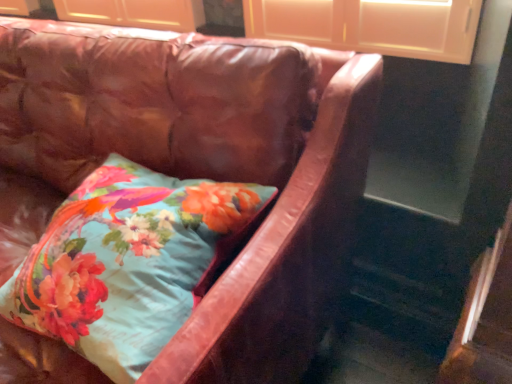
What do you see at coordinates (127, 262) in the screenshot? I see `floral fabric pillow at center` at bounding box center [127, 262].

The width and height of the screenshot is (512, 384). I want to click on floral fabric pillow at center, so click(x=127, y=262).

The height and width of the screenshot is (384, 512). Describe the element at coordinates (199, 167) in the screenshot. I see `leather couch at center` at that location.

Image resolution: width=512 pixels, height=384 pixels. I want to click on leather couch at center, so click(199, 167).

Find the location of `floral fabric pillow at center`. floral fabric pillow at center is located at coordinates (127, 262).

Does leather couch at center appear on the left side of floral fabric pillow at center?

Yes.

In the scene shown: Considering the relative positions of leather couch at center and floral fabric pillow at center in the image provided, is leather couch at center in front of floral fabric pillow at center?

Yes, leather couch at center is closer to the viewer.

Is point (49, 158) more distant than point (56, 303)?

Yes, it is behind point (56, 303).

From the image's perspective, which is below, leather couch at center or floral fabric pillow at center?

From the image's view, floral fabric pillow at center is below.

From a real-world perspective, which object stands above the other?

From a 3D spatial view, floral fabric pillow at center is above.

In the scene shown: Considering the sizes of objects leather couch at center and floral fabric pillow at center in the image provided, who is wider, leather couch at center or floral fabric pillow at center?

Wider between the two is leather couch at center.

Which of these two, leather couch at center or floral fabric pillow at center, stands shorter?

floral fabric pillow at center.

Between leather couch at center and floral fabric pillow at center, which one has smaller size?

Smaller between the two is floral fabric pillow at center.

Is leather couch at center not inside floral fabric pillow at center?

leather couch at center lies outside floral fabric pillow at center's area.

Is there a large distance between leather couch at center and floral fabric pillow at center?

No, leather couch at center is not far away from floral fabric pillow at center.

Could you tell me if leather couch at center is turned towards floral fabric pillow at center?

Yes.

How far apart are leather couch at center and floral fabric pillow at center?

leather couch at center is 7.28 inches from floral fabric pillow at center.

At what (x,y) coordinates should I click in order to perform the action: click on studio couch in front of the floral fabric pillow at center. Please return your answer as a coordinate pair (x, y). The image size is (512, 384). Looking at the image, I should click on (199, 167).

Which is more to the left, floral fabric pillow at center or leather couch at center?

leather couch at center is more to the left.

Which object is more forward, floral fabric pillow at center or leather couch at center?

Positioned in front is leather couch at center.

Which is in front, point (121, 366) or point (86, 156)?

The point (121, 366) is closer to the camera.

From the image's perspective, would you say floral fabric pillow at center is positioned over leather couch at center?

No, from the image's perspective, floral fabric pillow at center is not above leather couch at center.

From the picture: From a real-world perspective, is floral fabric pillow at center over leather couch at center?

Indeed, from a real-world perspective, floral fabric pillow at center stands above leather couch at center.

Can you confirm if floral fabric pillow at center is thinner than leather couch at center?

Correct, the width of floral fabric pillow at center is less than that of leather couch at center.

From the picture: Between floral fabric pillow at center and leather couch at center, which one has less height?

With less height is floral fabric pillow at center.

Considering the sizes of objects floral fabric pillow at center and leather couch at center in the image provided, who is bigger, floral fabric pillow at center or leather couch at center?

With larger size is leather couch at center.

Is floral fabric pillow at center outside of leather couch at center?

No, floral fabric pillow at center is inside or overlapping with leather couch at center.

Are floral fabric pillow at center and leather couch at center beside each other?

No, floral fabric pillow at center is not beside leather couch at center.

Is floral fabric pillow at center turned away from leather couch at center?

Yes.

How different are the orientations of floral fabric pillow at center and leather couch at center in degrees?

They differ by 0.0281 degrees in their facing directions.

At what (x,y) coordinates should I click in order to perform the action: click on pillow on the right side of leather couch at center. Please return your answer as a coordinate pair (x, y). The height and width of the screenshot is (384, 512). Looking at the image, I should click on (127, 262).

This screenshot has width=512, height=384. Identify the location of pillow behind the leather couch at center. click(x=127, y=262).

The width and height of the screenshot is (512, 384). There is a leather couch at center. What are the coordinates of `pillow above it (from a real-world perspective)` in the screenshot? It's located at (127, 262).